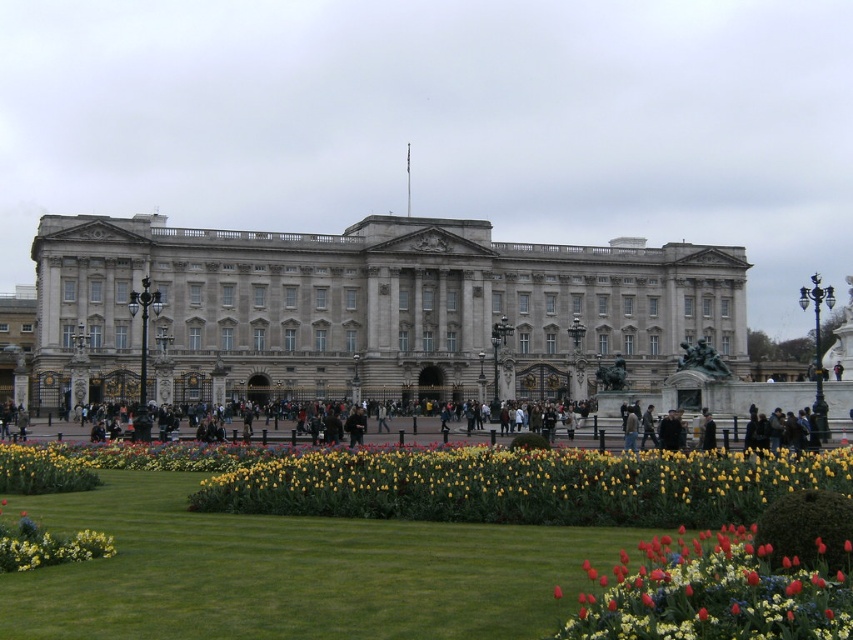
In the scene shown: You are standing in front of the Buckingham Palace gardens. You see a white stone building at center and a vivid red tulip at lower right. Which object is taller?

The white stone building at center is much taller than the vivid red tulip at lower right.

What is the 2D coordinate of the white stone building at center?

The white stone building at center is located at the 2D coordinate point of (370, 308).